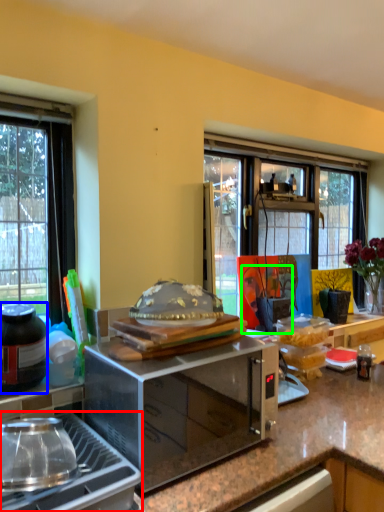
Question: Considering the real-world distances, which object is closest to gas stove (highlighted by a red box)? bottle (highlighted by a blue box) or person (highlighted by a green box).

Choices:
 (A) bottle
 (B) person

Answer: (A)